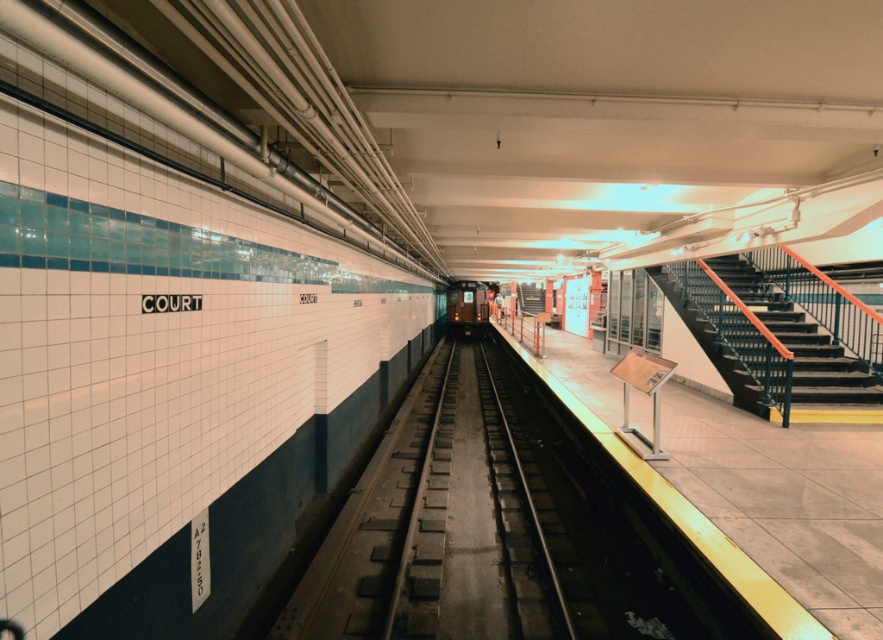
Can you confirm if black metal train track at center is smaller than metallic silver train at center?

Correct, black metal train track at center occupies less space than metallic silver train at center.

Locate an element on the screen. black metal train track at center is located at coordinates (478, 529).

You are a GUI agent. You are given a task and a screenshot of the screen. Output one action in this format:
    pyautogui.click(x=<x>, y=<y>)
    Task: Click on the black metal train track at center
    This screenshot has height=640, width=883.
    Given the screenshot: What is the action you would take?
    (478, 529)

Is point (881, 401) positioned behind point (477, 330)?

No.

How distant is metallic black staircase at right from metallic silver train at center?

metallic black staircase at right and metallic silver train at center are 22.22 meters apart.

Does point (685, 316) come farther from viewer compared to point (464, 314)?

No, (685, 316) is in front of (464, 314).

You are a GUI agent. You are given a task and a screenshot of the screen. Output one action in this format:
    pyautogui.click(x=<x>, y=<y>)
    Task: Click on the metallic black staircase at right
    The image size is (883, 640).
    Given the screenshot: What is the action you would take?
    pyautogui.click(x=801, y=339)

Is point (438, 422) positioned before point (722, 264)?

Yes, it is.

Find the location of a particular element. The image size is (883, 640). black metal train track at center is located at coordinates 478,529.